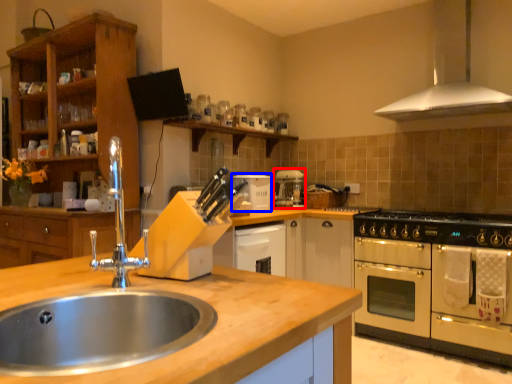
Question: Which point is further to the camera, coffee machine (highlighted by a red box) or appliance (highlighted by a blue box)?

Choices:
 (A) coffee machine
 (B) appliance

Answer: (A)